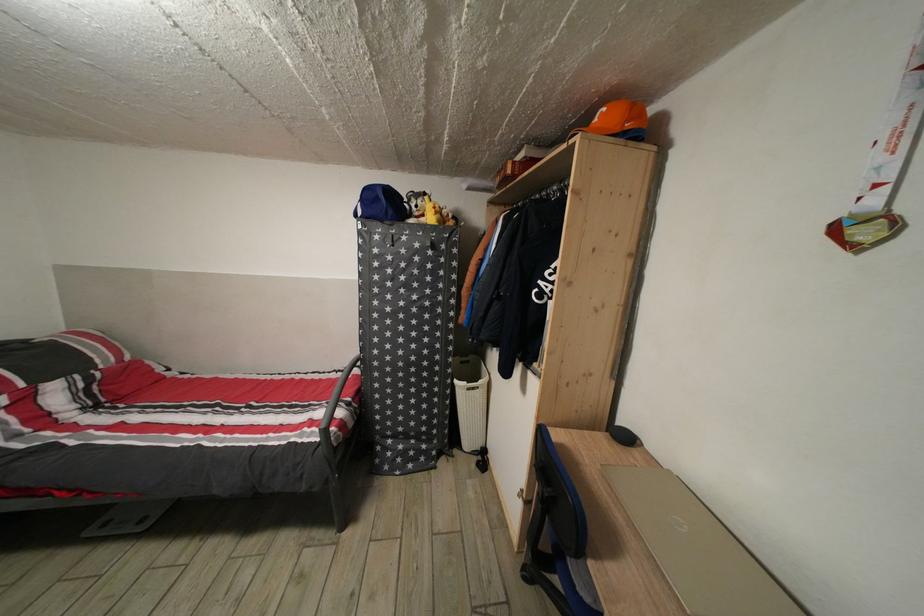
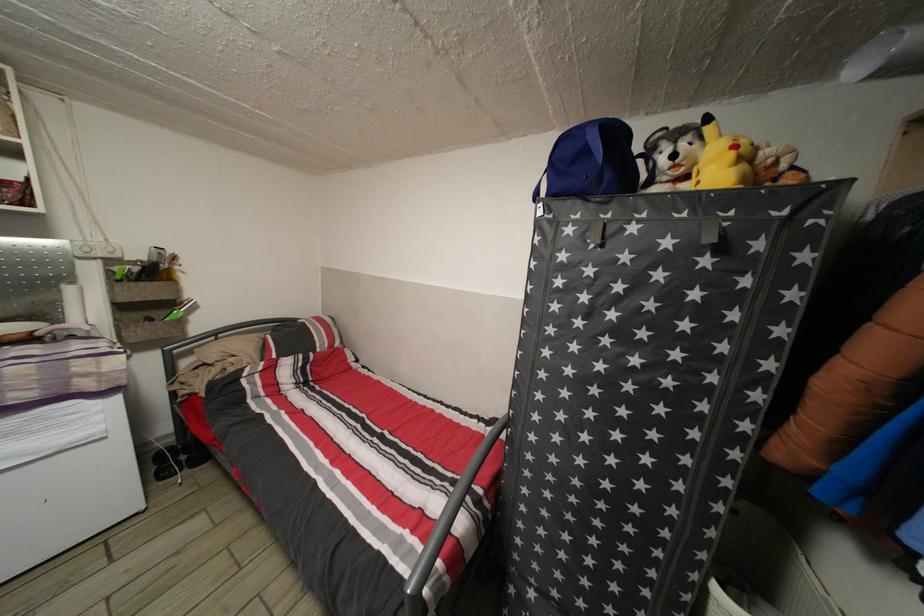
Where in the second image is the point corresponding to (x=463, y=387) from the first image?

(723, 594)